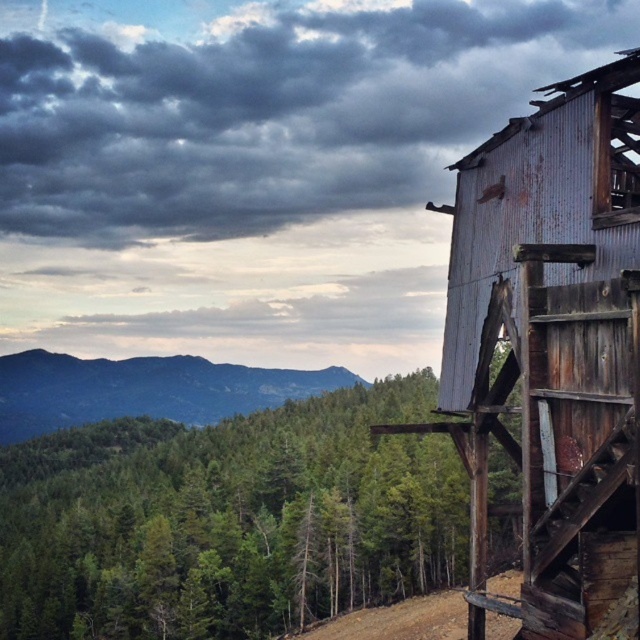
Consider the image. Is rusty corrugated metal hut at right below brown dirt track at lower center?

No, rusty corrugated metal hut at right is not below brown dirt track at lower center.

Between rusty corrugated metal hut at right and brown dirt track at lower center, which one is positioned lower?

brown dirt track at lower center is below.

Identify the location of rusty corrugated metal hut at right. Image resolution: width=640 pixels, height=640 pixels. (552, 346).

Can you confirm if green matte tree at center is shorter than rusty corrugated metal hut at right?

In fact, green matte tree at center may be taller than rusty corrugated metal hut at right.

Is green matte tree at center to the left of rusty corrugated metal hut at right from the viewer's perspective?

Indeed, green matte tree at center is positioned on the left side of rusty corrugated metal hut at right.

Who is more distant from viewer, (304, 573) or (602, 268)?

The point (304, 573) is behind.

Where is `green matte tree at center`? This screenshot has width=640, height=640. green matte tree at center is located at coordinates (228, 518).

I want to click on green forested mountain at upper left, so click(x=141, y=388).

Can you confirm if green forested mountain at upper left is bigger than brown dirt track at lower center?

Yes.

Who is more forward, (48, 420) or (445, 595)?

Positioned in front is point (445, 595).

At what (x,y) coordinates should I click in order to perform the action: click on green forested mountain at upper left. Please return your answer as a coordinate pair (x, y). Looking at the image, I should click on (141, 388).